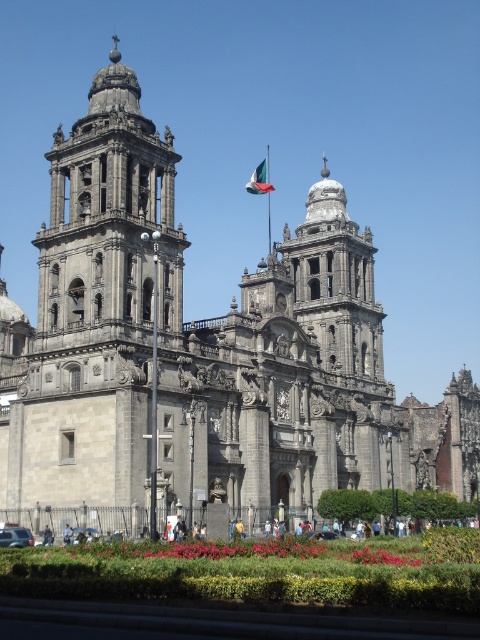
You are a photographer planning to capture the gray stone tower at upper left and the green fabric flag at center in a single frame. Based on their sizes in the image, which object might appear larger in your photo?

The gray stone tower at upper left might appear larger than the green fabric flag at center because it might be wider according to the description.

Based on the photo, you are standing in front of the cathedral and want to take a photo of the gray stone tower at upper left and the green fabric flag at center. Which object should you place on the left side of your photo to capture both in the frame?

You should place the gray stone tower at upper left on the left side of your photo since it is already positioned to the left of the green fabric flag at center in the scene.

You are standing in front of the cathedral and want to take a photo that includes both the Mexican flag and the vibrant red flowers in the garden. The Mexican flag is located at point (108,198) and the red flowers are at point (264,164). Since you can only focus on one point at a time, which point should you focus on to ensure the other element is also in the frame?

You should focus on point (108,198) because it is closer to the viewer than point (264,164). By focusing on the closer point, the depth of field may include the farther point in the frame.